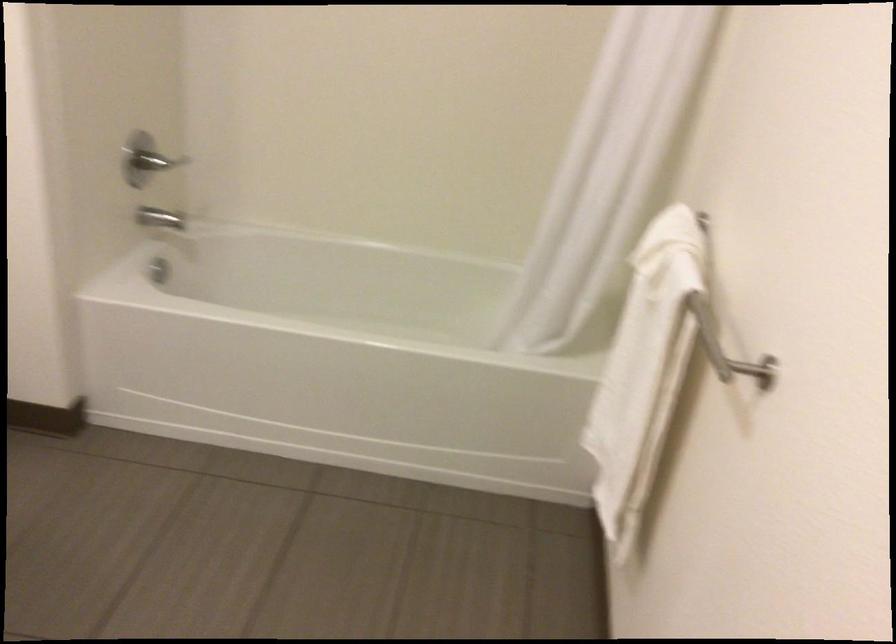
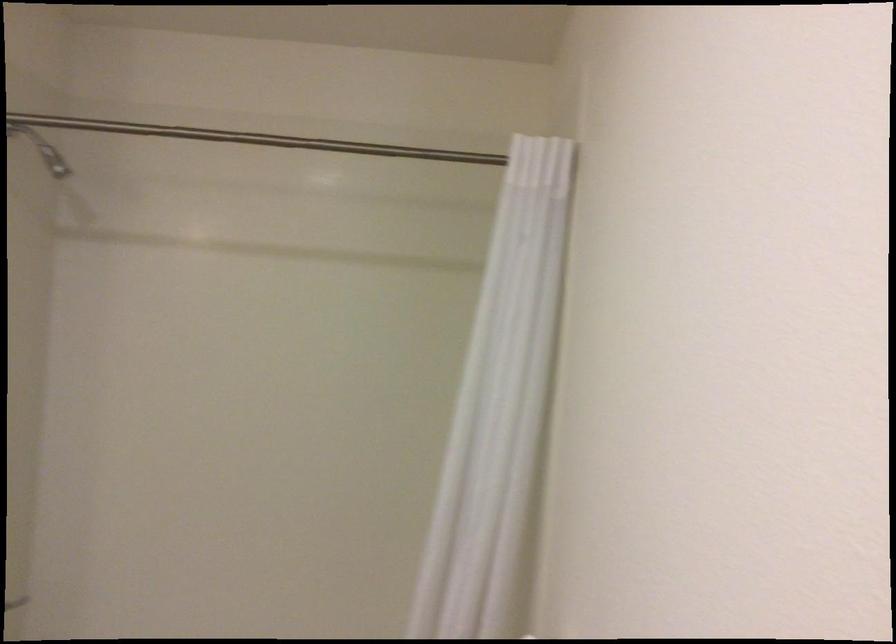
Question: The first image is from the beginning of the video and the second image is from the end. How did the camera likely rotate when shooting the video?

Choices:
 (A) Left
 (B) Right
 (C) Up
 (D) Down

Answer: (C)